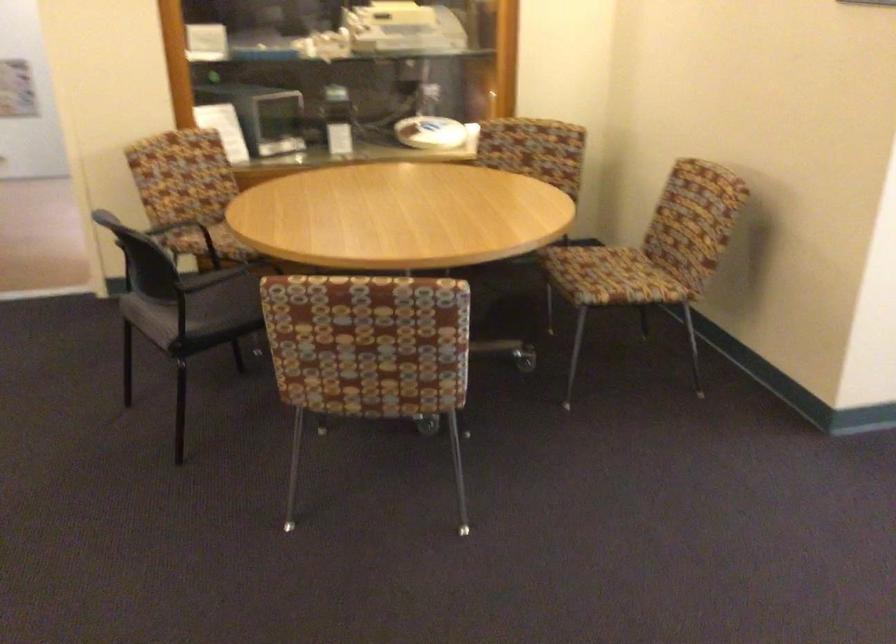
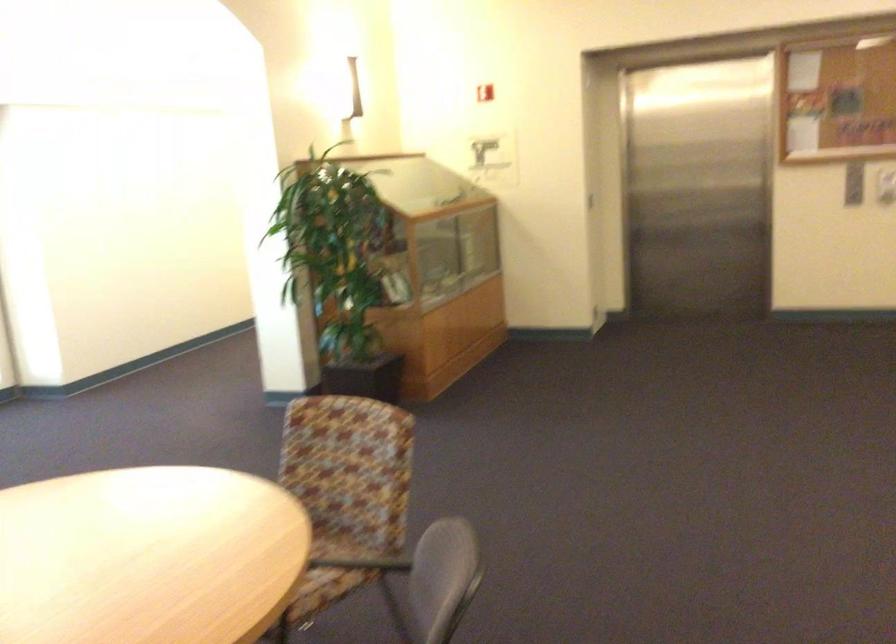
Where in the second image is the point corresponding to point (278, 238) from the first image?

(288, 535)